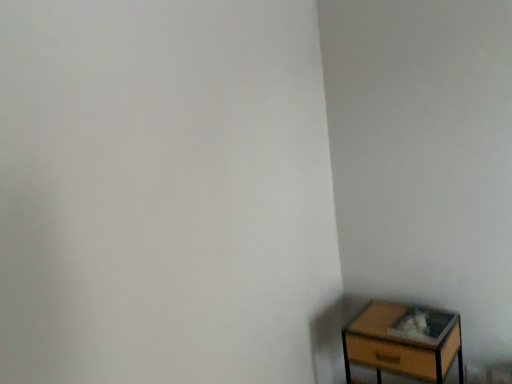
Where is `wooden drawer at lower right`? The width and height of the screenshot is (512, 384). wooden drawer at lower right is located at coordinates (403, 341).

The image size is (512, 384). What do you see at coordinates (403, 341) in the screenshot? I see `wooden drawer at lower right` at bounding box center [403, 341].

Find the location of a particular element. The height and width of the screenshot is (384, 512). wooden drawer at lower right is located at coordinates (403, 341).